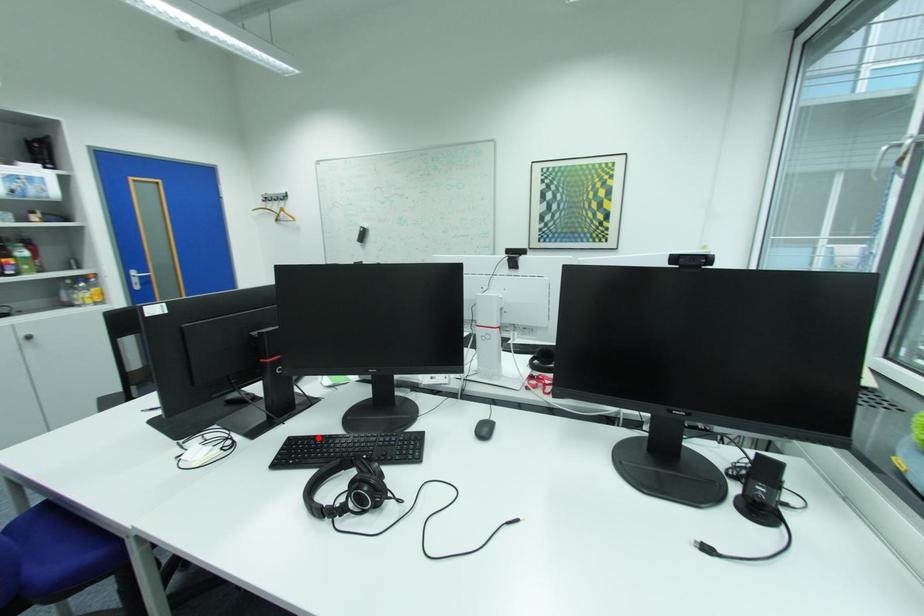
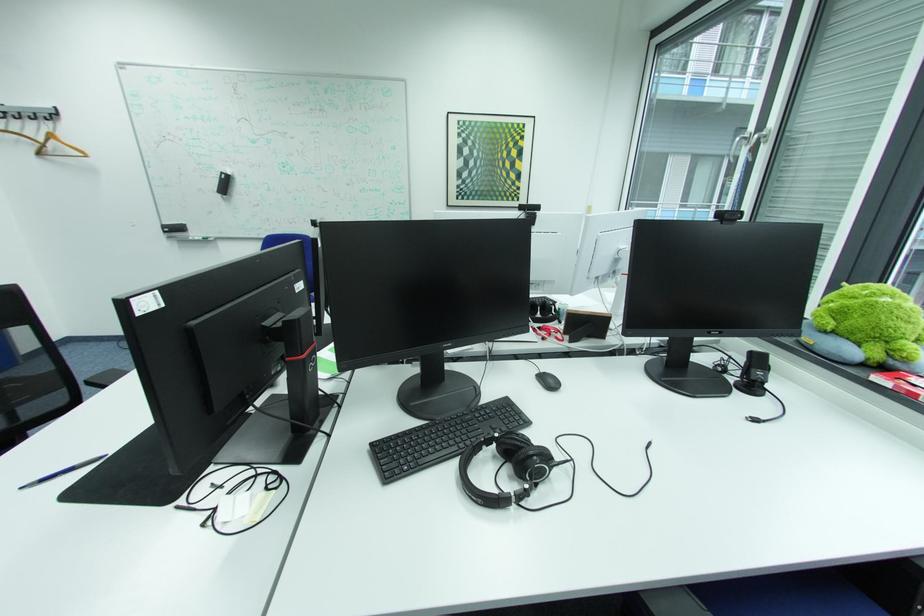
Find the pixel in the second image that matches the highlighted location in the first image.

(406, 437)